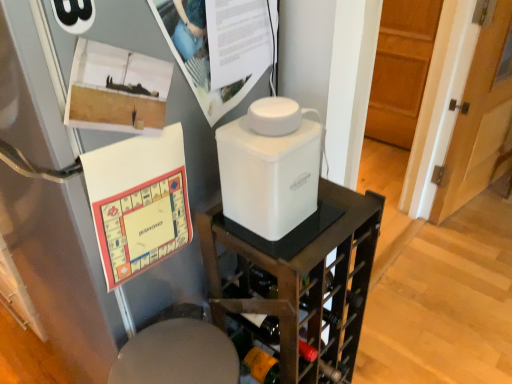
Question: Could you tell me if wooden door at right is facing white plastic container at center?

Choices:
 (A) yes
 (B) no

Answer: (A)

Question: Is wooden door at right at the right side of white plastic container at center?

Choices:
 (A) no
 (B) yes

Answer: (B)

Question: Considering the relative sizes of wooden door at right and white plastic container at center in the image provided, is wooden door at right shorter than white plastic container at center?

Choices:
 (A) yes
 (B) no

Answer: (B)

Question: Considering the relative positions of wooden door at right and white plastic container at center in the image provided, is wooden door at right to the left of white plastic container at center from the viewer's perspective?

Choices:
 (A) yes
 (B) no

Answer: (B)

Question: From the image's perspective, does wooden door at right appear lower than white plastic container at center?

Choices:
 (A) no
 (B) yes

Answer: (A)

Question: Is point (365, 127) positioned closer to the camera than point (170, 38)?

Choices:
 (A) closer
 (B) farther

Answer: (B)

Question: From a real-world perspective, is wooden door at right physically located above or below matte paper poster at upper center?

Choices:
 (A) above
 (B) below

Answer: (B)

Question: Is wooden door at right to the left or to the right of matte paper poster at upper center in the image?

Choices:
 (A) right
 (B) left

Answer: (A)

Question: In terms of width, does wooden door at right look wider or thinner when compared to matte paper poster at upper center?

Choices:
 (A) thin
 (B) wide

Answer: (A)

Question: In the image, is white plastic container at center on the left side or the right side of white plastic container at center?

Choices:
 (A) left
 (B) right

Answer: (A)

Question: From the image's perspective, is white plastic container at center located above or below white plastic container at center?

Choices:
 (A) below
 (B) above

Answer: (B)

Question: Is white plastic container at center inside the boundaries of white plastic container at center, or outside?

Choices:
 (A) outside
 (B) inside

Answer: (A)

Question: In terms of width, does white plastic container at center look wider or thinner when compared to white plastic container at center?

Choices:
 (A) wide
 (B) thin

Answer: (B)

Question: Looking at their shapes, would you say matte paper poster at upper center is wider or thinner than wooden door at right?

Choices:
 (A) thin
 (B) wide

Answer: (B)

Question: Is matte paper poster at upper center in front of or behind wooden door at right in the image?

Choices:
 (A) front
 (B) behind

Answer: (A)